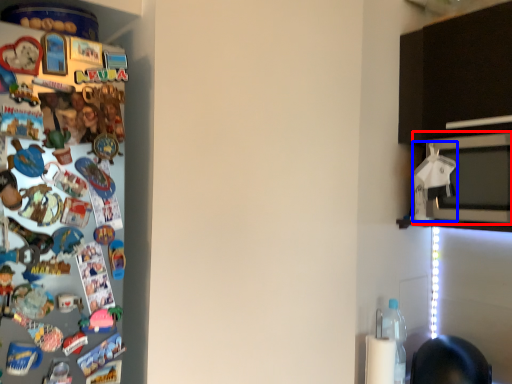
Question: Which point is closer to the camera, microwave oven (highlighted by a red box) or toy (highlighted by a blue box)?

Choices:
 (A) microwave oven
 (B) toy

Answer: (A)